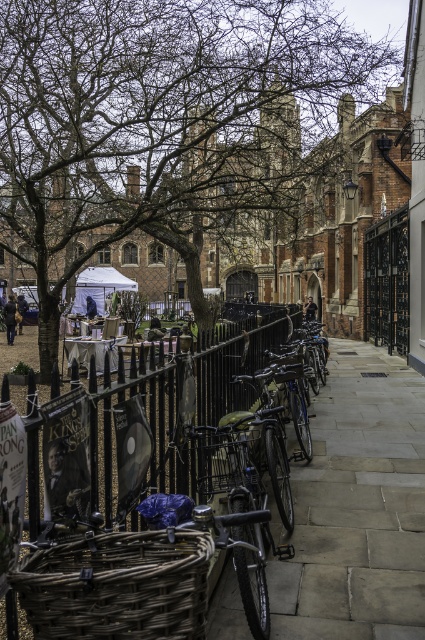
Which is more to the right, brown leafless tree at upper left or woven brown basket at lower left?

From the viewer's perspective, woven brown basket at lower left appears more on the right side.

Is brown leafless tree at upper left smaller than woven brown basket at lower left?

No.

This screenshot has width=425, height=640. What do you see at coordinates (159, 122) in the screenshot? I see `brown leafless tree at upper left` at bounding box center [159, 122].

The image size is (425, 640). I want to click on brown leafless tree at upper left, so click(159, 122).

Which of these two, brown leafless tree at upper left or black metal fence at center, stands taller?

brown leafless tree at upper left is taller.

Does brown leafless tree at upper left have a greater width compared to black metal fence at center?

Yes.

Identify the location of brown leafless tree at upper left. The width and height of the screenshot is (425, 640). (159, 122).

Consider the image. Does gray stone pavement at center have a greater height compared to black metal fence at center?

No, gray stone pavement at center is not taller than black metal fence at center.

I want to click on gray stone pavement at center, so click(357, 508).

Identify the location of gray stone pavement at center. (357, 508).